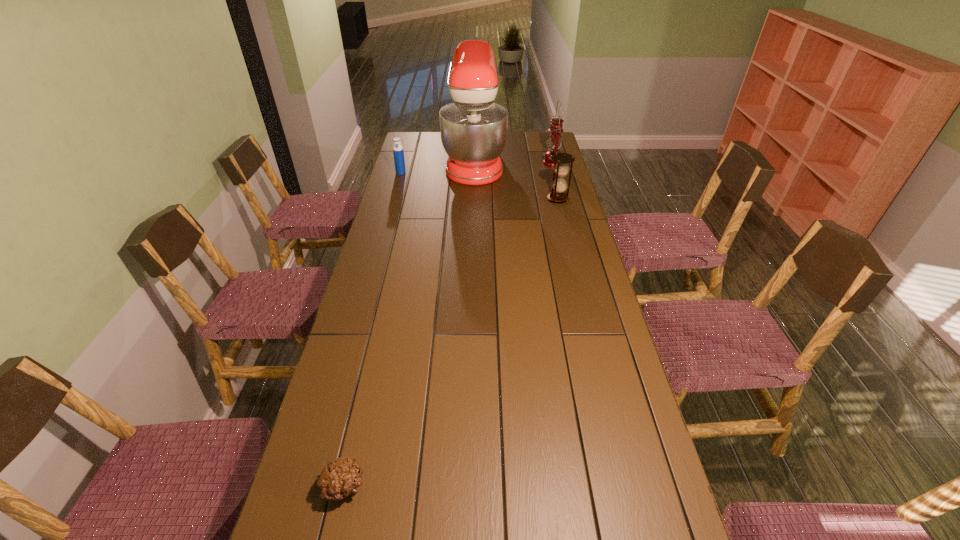
This screenshot has width=960, height=540. Find the location of `free space between the mixer and the hourglass`. free space between the mixer and the hourglass is located at coordinates (516, 180).

Identify the location of vacant space in between the nearest object and the mixer. (409, 324).

Where is `vacant area that lies between the fourth shortest object and the shortest object`? vacant area that lies between the fourth shortest object and the shortest object is located at coordinates (448, 325).

This screenshot has height=540, width=960. What are the coordinates of `vacant area that lies between the mixer and the nearest object` in the screenshot? It's located at (409, 324).

Where is `free point between the fourth farthest object and the mixer`? free point between the fourth farthest object and the mixer is located at coordinates (516, 180).

Image resolution: width=960 pixels, height=540 pixels. Identify the location of vacant area that lies between the third object from left to right and the hourglass. (516, 180).

At what (x,y) coordinates should I click in order to perform the action: click on unoccupied area between the mixer and the water bottle. Please return your answer as a coordinate pair (x, y). This screenshot has height=540, width=960. Looking at the image, I should click on (438, 167).

At what (x,y) coordinates should I click in order to perform the action: click on free space between the second shortest object and the fourth farthest object. Please return your answer as a coordinate pair (x, y). The width and height of the screenshot is (960, 540). Looking at the image, I should click on (479, 186).

What are the coordinates of `object that is the closest to the fourth shortest object` in the screenshot? It's located at (473, 128).

The image size is (960, 540). I want to click on object that ranks as the third closest to the nearest object, so click(398, 152).